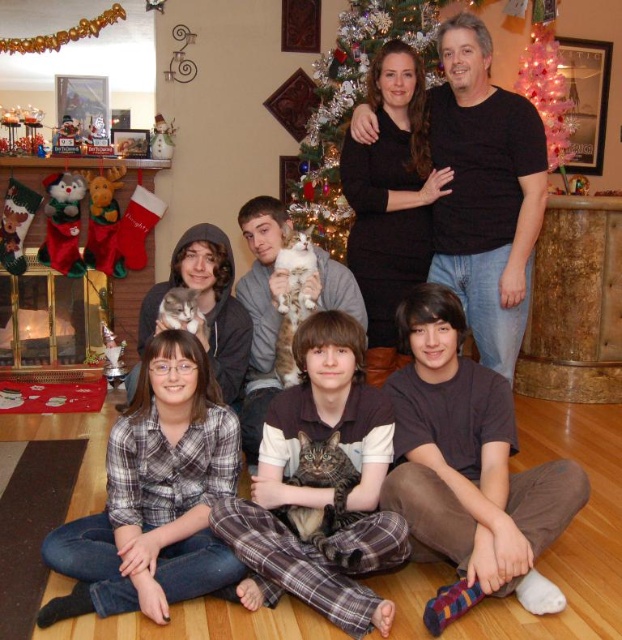
Question: Which of these objects is positioned closest to the plaid shirt at lower left?

Choices:
 (A) pink glittering christmas tree at upper center
 (B) striped fabric cat at center
 (C) green glittering christmas tree at upper center

Answer: (B)

Question: Is striped fabric cat at center closer to camera compared to pink glittering christmas tree at upper center?

Choices:
 (A) no
 (B) yes

Answer: (B)

Question: Can you confirm if plaid shirt at lower left is wider than green glittering christmas tree at upper center?

Choices:
 (A) yes
 (B) no

Answer: (B)

Question: Which of these objects is positioned closest to the striped fabric cat at center?

Choices:
 (A) pink glittering christmas tree at upper center
 (B) green glittering christmas tree at upper center

Answer: (B)

Question: Estimate the real-world distances between objects in this image. Which object is farther from the green glittering christmas tree at upper center?

Choices:
 (A) striped fabric cat at center
 (B) pink glittering christmas tree at upper center
 (C) plaid shirt at lower left

Answer: (C)

Question: Can you confirm if brown cotton shirt at lower right is positioned to the left of striped fabric cat at center?

Choices:
 (A) no
 (B) yes

Answer: (A)